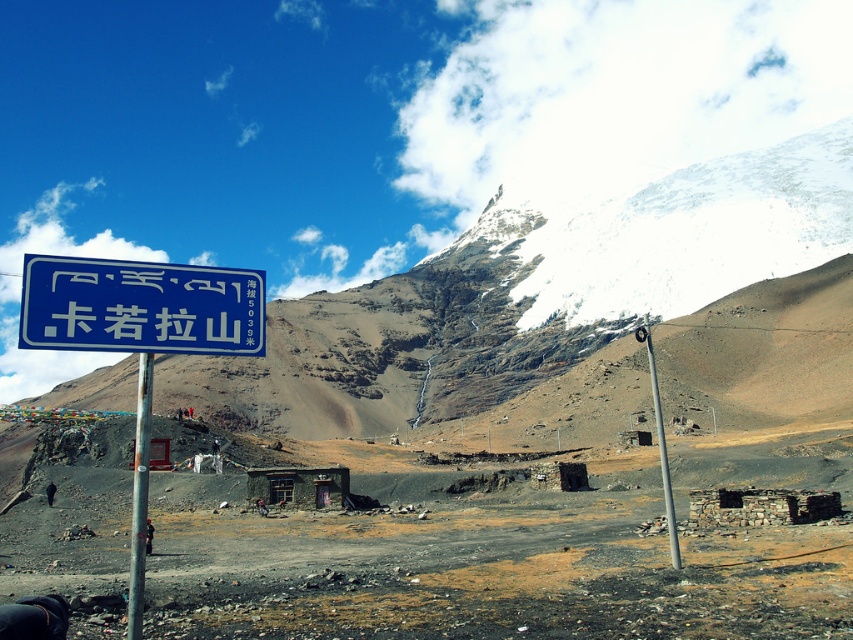
Does blue plastic sign at center have a smaller size compared to metallic pole at right?

Correct, blue plastic sign at center occupies less space than metallic pole at right.

Is point (132, 320) more distant than point (662, 474)?

No, (132, 320) is closer to viewer.

Find the location of a particular element. This screenshot has width=853, height=640. blue plastic sign at center is located at coordinates (140, 307).

Describe the element at coordinates (140, 307) in the screenshot. I see `blue plastic sign at center` at that location.

The image size is (853, 640). What are the coordinates of `blue plastic sign at center` in the screenshot? It's located at (140, 307).

Between white snow-covered mountain at upper center and blue plastic sign at center, which one is positioned lower?

blue plastic sign at center is lower down.

Between point (434, 365) and point (111, 285), which one is positioned in front?

Positioned in front is point (111, 285).

Is point (325, 307) in front of point (187, 280)?

No.

Identify the location of white snow-covered mountain at upper center. The width and height of the screenshot is (853, 640). (529, 294).